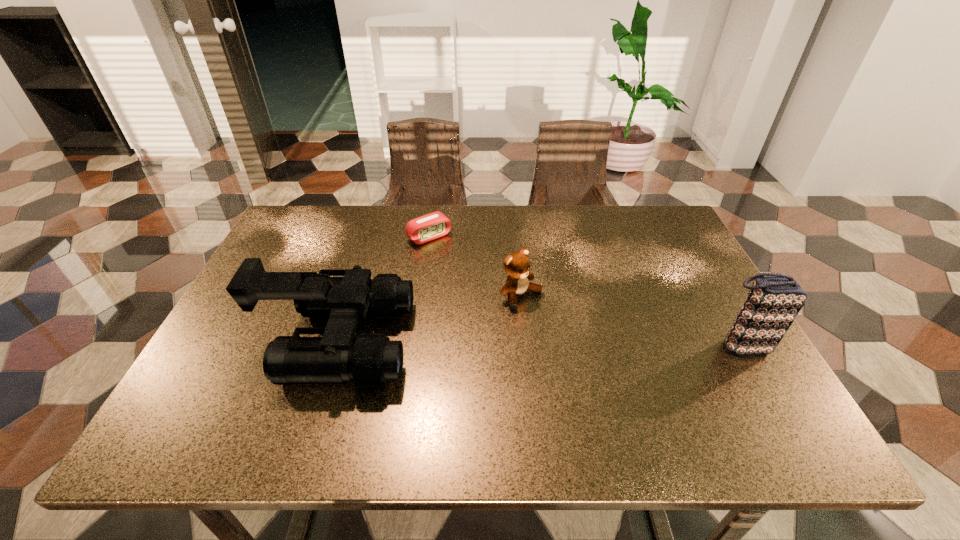
Locate an element on the screen. The height and width of the screenshot is (540, 960). free point between the binoculars and the teddy bear is located at coordinates (429, 319).

Where is `vacant area between the rightmost object and the shortest object`? vacant area between the rightmost object and the shortest object is located at coordinates (586, 292).

You are a GUI agent. You are given a task and a screenshot of the screen. Output one action in this format:
    pyautogui.click(x=<x>, y=<y>)
    Task: Click on the empty space that is in between the shortest object and the clutch bag
    This screenshot has height=540, width=960.
    Given the screenshot: What is the action you would take?
    pyautogui.click(x=586, y=292)

Identify which object is the third closest to the binoculars. Please provide its 2D coordinates. Your answer should be formatted as a tuple, i.e. [(x, y)], where the tuple contains the x and y coordinates of a point satisfying the conditions above.

[(774, 300)]

Point out which object is positioned as the nearest to the clutch bag. Please provide its 2D coordinates. Your answer should be formatted as a tuple, i.e. [(x, y)], where the tuple contains the x and y coordinates of a point satisfying the conditions above.

[(517, 265)]

Identify the location of free location that satisfies the following two spatial constraints: 1. on the front side of the shortest object; 2. with the zip open on the rightmost object. (413, 346).

Locate an element on the screen. The width and height of the screenshot is (960, 540). vacant space that satisfies the following two spatial constraints: 1. on the front side of the farthest object; 2. with the zip open on the clutch bag is located at coordinates (413, 346).

Where is `vacant position in the image that satisfies the following two spatial constraints: 1. on the front side of the alarm clock; 2. with the zip open on the clutch bag`? The height and width of the screenshot is (540, 960). vacant position in the image that satisfies the following two spatial constraints: 1. on the front side of the alarm clock; 2. with the zip open on the clutch bag is located at coordinates (413, 346).